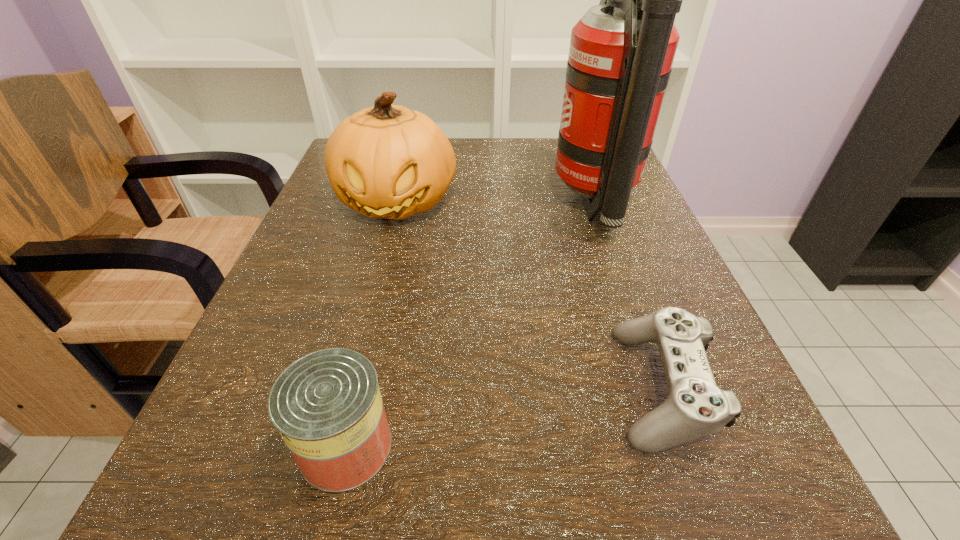
Locate an element on the screen. The image size is (960, 540). blank area in the image that satisfies the following two spatial constraints: 1. on the front label side of the fire extinguisher; 2. on the back side of the shortest object is located at coordinates (658, 386).

Find the location of a particular element. The width and height of the screenshot is (960, 540). free point that satisfies the following two spatial constraints: 1. on the front label side of the fire extinguisher; 2. on the left side of the control is located at coordinates (658, 386).

Where is `vacant space that satisfies the following two spatial constraints: 1. on the front face of the second tallest object; 2. on the left side of the control`? This screenshot has width=960, height=540. vacant space that satisfies the following two spatial constraints: 1. on the front face of the second tallest object; 2. on the left side of the control is located at coordinates (350, 386).

Where is `vacant space that satisfies the following two spatial constraints: 1. on the front label side of the fire extinguisher; 2. on the right side of the shortest object`? The height and width of the screenshot is (540, 960). vacant space that satisfies the following two spatial constraints: 1. on the front label side of the fire extinguisher; 2. on the right side of the shortest object is located at coordinates (658, 386).

I want to click on free space that satisfies the following two spatial constraints: 1. on the back side of the third tallest object; 2. on the left side of the control, so click(x=360, y=386).

Locate an element on the screen. The width and height of the screenshot is (960, 540). free spot that satisfies the following two spatial constraints: 1. on the front face of the pumpkin; 2. on the right side of the second shortest object is located at coordinates (335, 446).

Identify the location of vacant area that satisfies the following two spatial constraints: 1. on the front face of the second tallest object; 2. on the left side of the can. (335, 446).